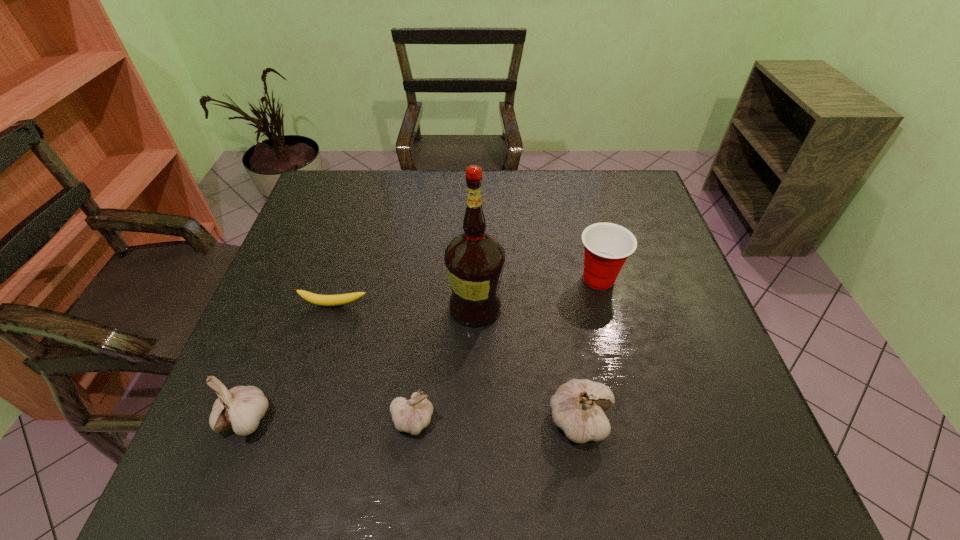
Find the location of `the second shortest garlic`. the second shortest garlic is located at coordinates (242, 407).

Find the location of a particular element. the fifth tallest object is located at coordinates (411, 416).

You are a GUI agent. You are given a task and a screenshot of the screen. Output one action in this format:
    pyautogui.click(x=<x>, y=<y>)
    Task: Click on the third object from left to right
    The height and width of the screenshot is (540, 960).
    Given the screenshot: What is the action you would take?
    pyautogui.click(x=411, y=416)

Find the location of a particular element. This screenshot has height=540, width=960. the rightmost garlic is located at coordinates (578, 406).

Locate an element on the screen. cup is located at coordinates (607, 246).

Where is `the shortest object`? This screenshot has height=540, width=960. the shortest object is located at coordinates (341, 299).

The height and width of the screenshot is (540, 960). Find the location of `alcohol`. alcohol is located at coordinates (474, 260).

At what (x,y) coordinates should I click in order to perform the action: click on the third object from right to left. Please return your answer as a coordinate pair (x, y). The image size is (960, 540). Looking at the image, I should click on (474, 260).

At what (x,y) coordinates should I click in order to perform the action: click on vacant space situated 0.140m on the right of the leftmost garlic. Please return your answer as a coordinate pair (x, y). This screenshot has width=960, height=540. Looking at the image, I should click on (343, 418).

Find the location of a particular element. vacant point located 0.160m on the right of the second shortest object is located at coordinates (516, 420).